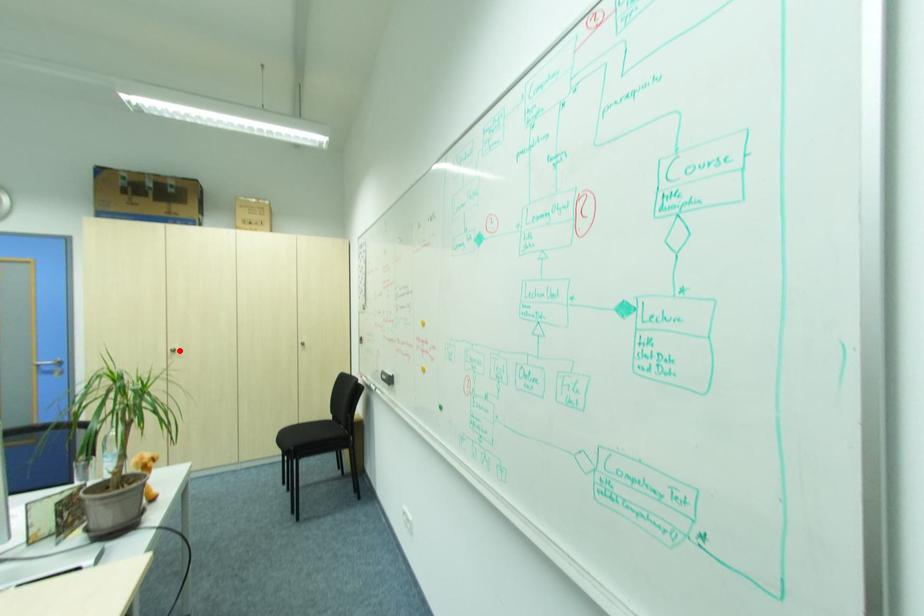
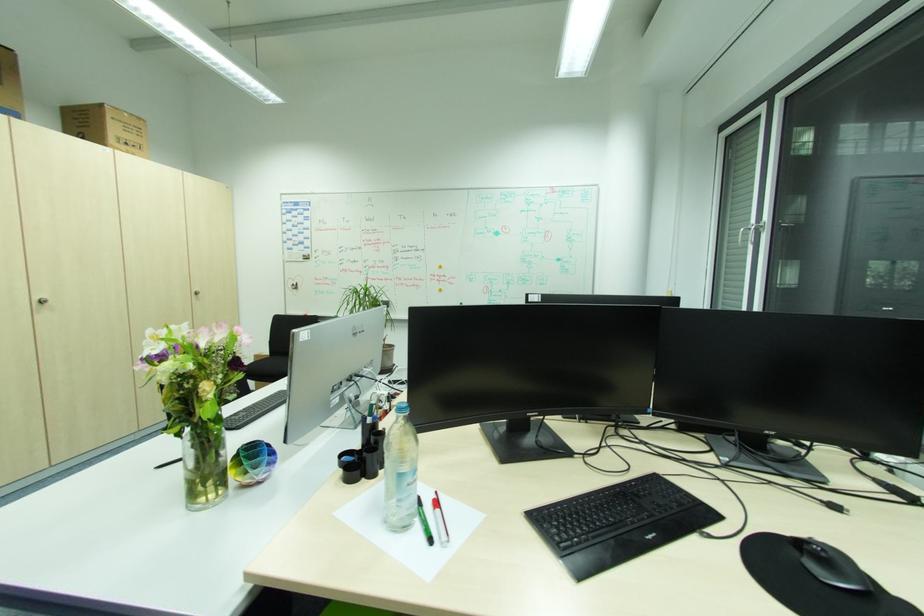
The point at the highlighted location is marked in the first image. Where is the corresponding point in the second image?

(47, 302)